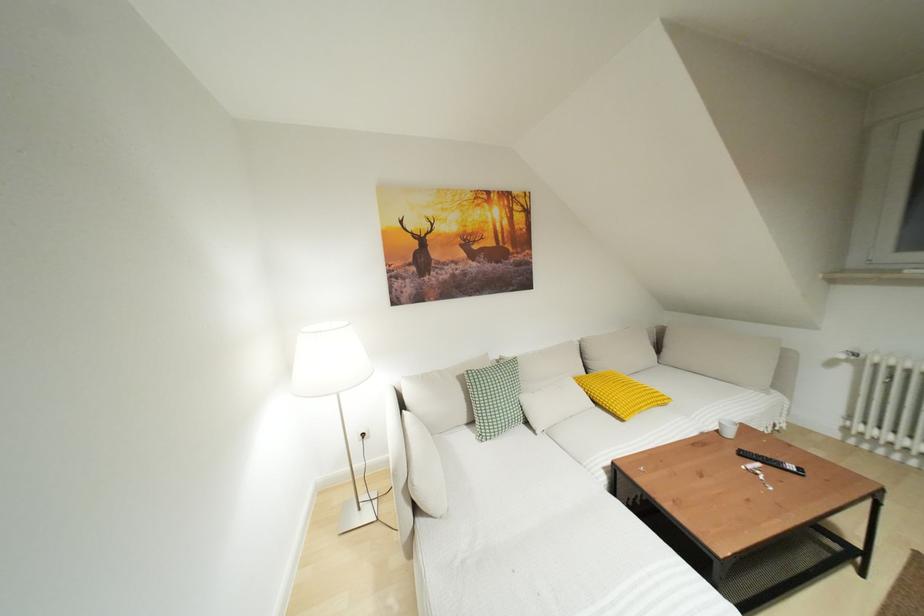
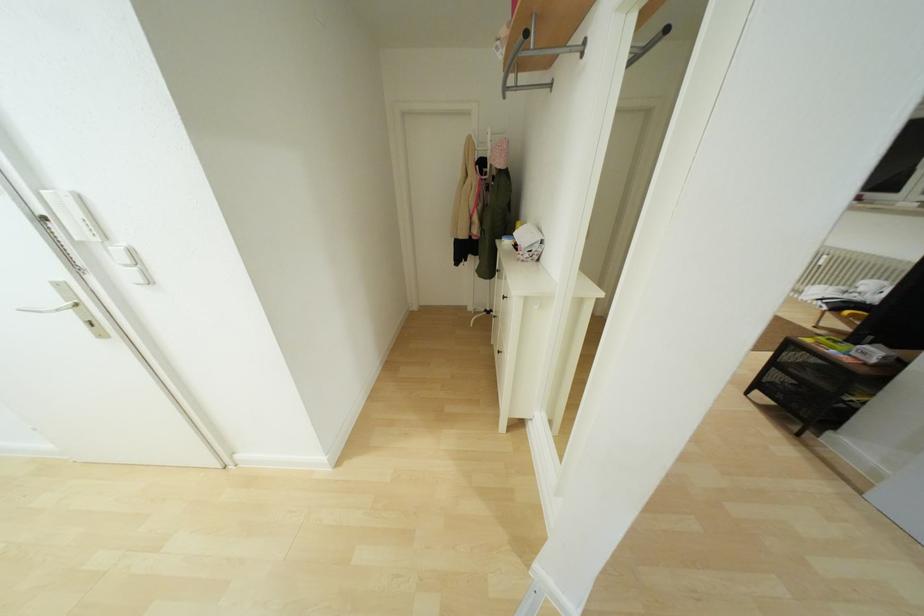
Question: The images are taken continuously from a first-person perspective. In which direction are you moving?

Choices:
 (A) Left
 (B) Right
 (C) Forward
 (D) Backward

Answer: (D)